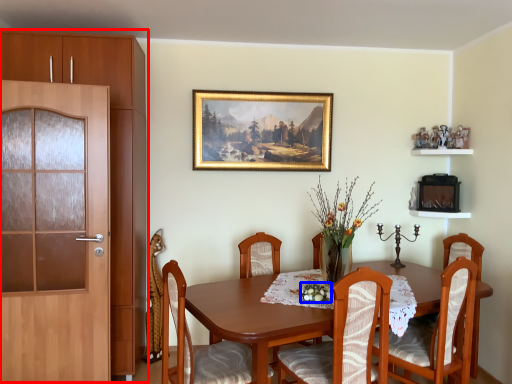
Question: Among these objects, which one is nearest to the camera, cabinetry (highlighted by a red box) or floral arrangement (highlighted by a blue box)?

Choices:
 (A) cabinetry
 (B) floral arrangement

Answer: (B)